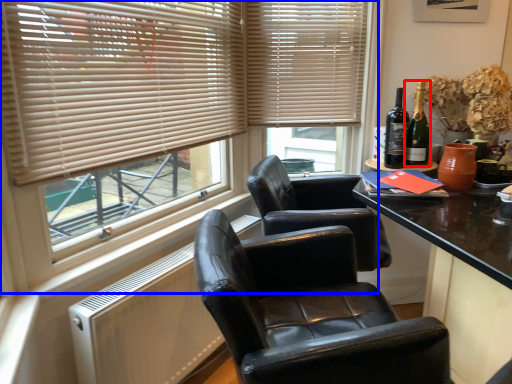
Question: Which object is closer to the camera taking this photo, bottle (highlighted by a red box) or window (highlighted by a blue box)?

Choices:
 (A) bottle
 (B) window

Answer: (B)